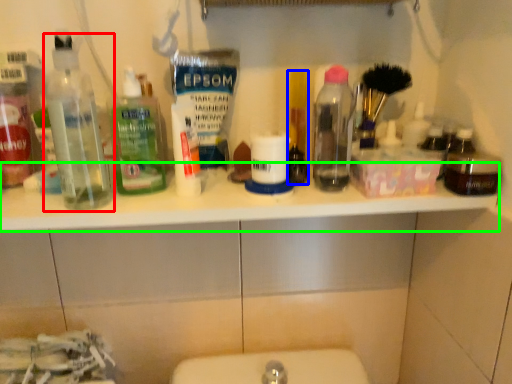
Question: Considering the real-world distances, which object is farthest from bottle (highlighted by a red box)? personal care (highlighted by a blue box) or counter top (highlighted by a green box)?

Choices:
 (A) personal care
 (B) counter top

Answer: (A)